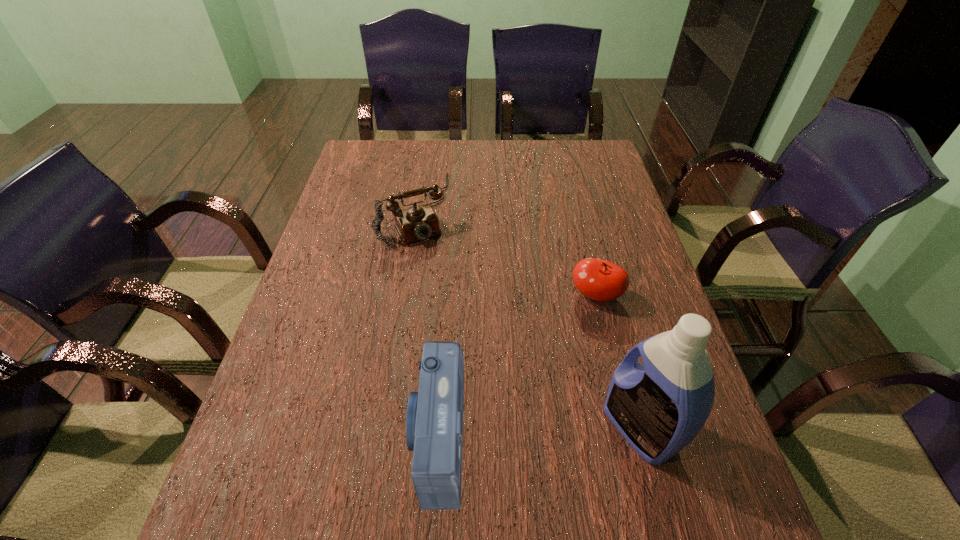
Find the location of a particular element. This screenshot has height=540, width=960. camera is located at coordinates (434, 421).

Where is `the tallest object`? the tallest object is located at coordinates (659, 407).

Where is `the third nearest object`? the third nearest object is located at coordinates (600, 280).

I want to click on the farthest object, so click(416, 223).

Identify the location of vacant point located 0.140m on the lens of the camera. The width and height of the screenshot is (960, 540). (340, 436).

The height and width of the screenshot is (540, 960). In order to click on free spot located 0.070m on the lens of the camera in this screenshot , I will do `click(375, 436)`.

Identify the location of blank area located 0.220m on the lens of the camera. (299, 436).

This screenshot has height=540, width=960. Find the location of `blank space located on the back of the tallest object`. blank space located on the back of the tallest object is located at coordinates (618, 347).

This screenshot has height=540, width=960. What are the coordinates of `vacant area located 0.060m on the stem of the apple` in the screenshot? It's located at (574, 326).

The width and height of the screenshot is (960, 540). What are the coordinates of `free location located 0.320m on the stem of the apple` in the screenshot? It's located at (520, 412).